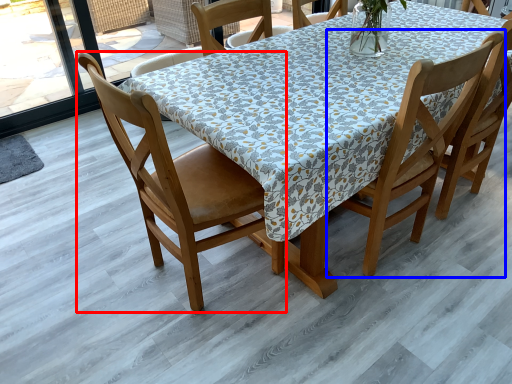
Question: Which of the following is the farthest to the observer, chair (highlighted by a red box) or chair (highlighted by a blue box)?

Choices:
 (A) chair
 (B) chair

Answer: (B)